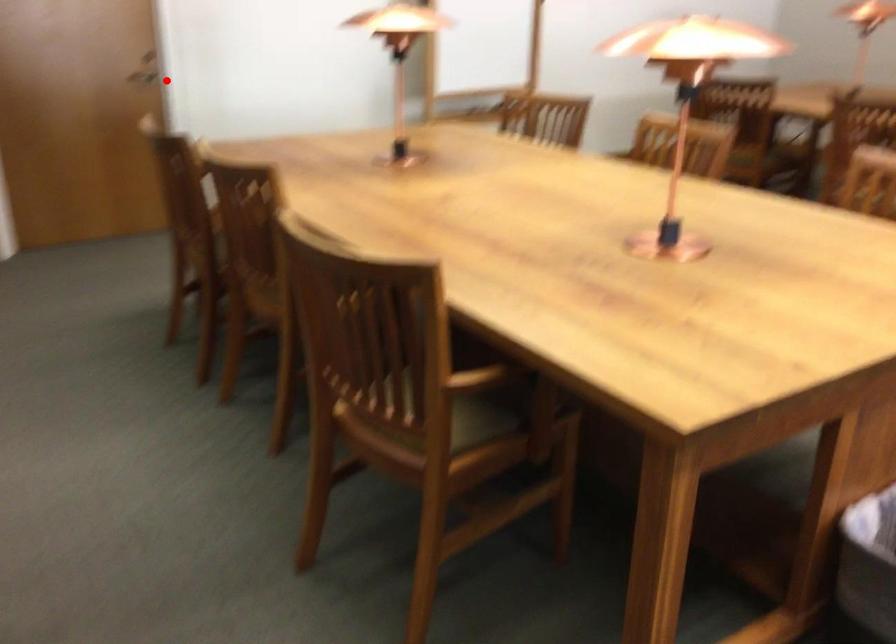
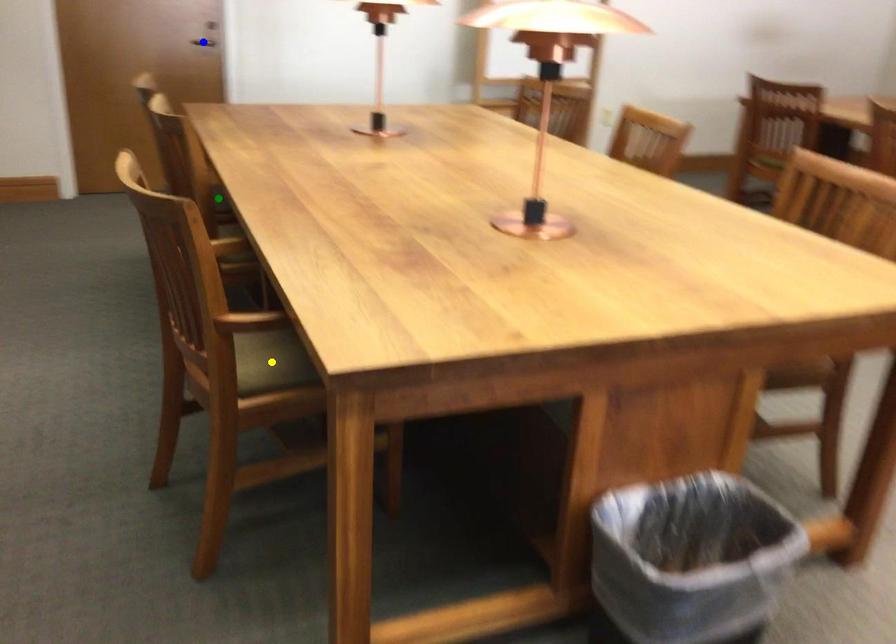
Question: I am providing you with two images of the same scene from different viewpoints. A red point is marked on the first image. You are given multiple points on the second image. Which mark in image 2 goes with the point in image 1?

Choices:
 (A) green point
 (B) yellow point
 (C) blue point

Answer: (C)